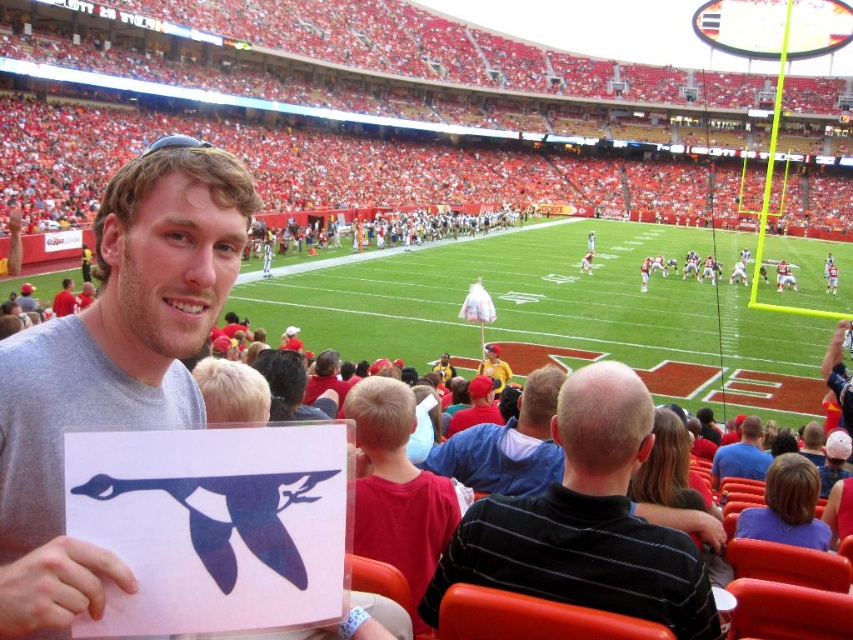
Can you confirm if blue fabric shirt at center is taller than yellow fabric at center?

Yes, blue fabric shirt at center is taller than yellow fabric at center.

Between blue fabric shirt at center and yellow fabric at center, which one appears on the left side from the viewer's perspective?

Positioned to the left is blue fabric shirt at center.

Identify the location of blue fabric shirt at center. (508, 444).

Locate an element on the screen. This screenshot has width=853, height=640. blue fabric shirt at center is located at coordinates (508, 444).

Can you confirm if smooth blue shirt at center is bigger than red fabric cap at center?

Indeed, smooth blue shirt at center has a larger size compared to red fabric cap at center.

Which is above, smooth blue shirt at center or red fabric cap at center?

red fabric cap at center is higher up.

In order to click on smooth blue shirt at center in this screenshot , I will do `click(741, 454)`.

Which of these two, blue fabric shirt at center or red fabric cap at center, stands shorter?

With less height is red fabric cap at center.

In the scene shown: Is blue fabric shirt at center smaller than red fabric cap at center?

No.

Which is in front, point (526, 445) or point (479, 406)?

Point (526, 445)

Where is `blue fabric shirt at center`? The image size is (853, 640). blue fabric shirt at center is located at coordinates (508, 444).